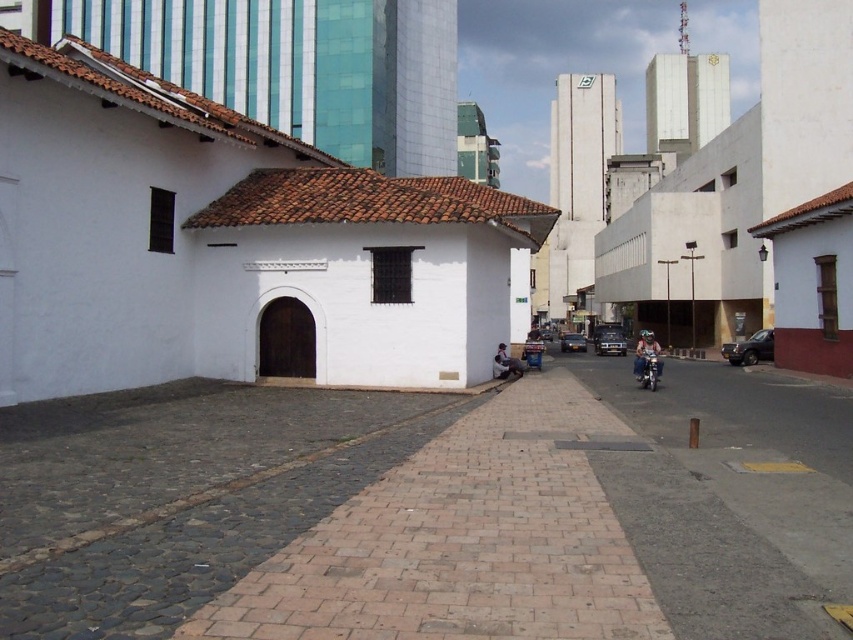
You are a delivery person trying to park your metallic silver sedan at center in a parking spot that can only accommodate vehicles narrower than the dark brown leather jacket at center. Can your car fit in the spot?

The dark brown leather jacket at center is wider than the metallic silver sedan at center, so the sedan can fit in the parking spot since it is narrower than the jacket.

You are standing in the middle of the scene and want to place a small decorative statue between the two points, point (563, 340) and point (550, 339). Which point should the statue be closer to in order to appear closer to the traditional building on the left?

The statue should be placed closer to point (563, 340) because it is closer to the viewer than point (550, 339). Since the traditional building is on the left side of the scene, positioning the statue near the closer point will make it appear nearer to the traditional building from the viewer perspective.

You are a delivery person trying to park your shiny silver sedan at center between the modern high rises and the traditional building. The metallic silver sedan at center is blocking the parking spot. Can you safely maneuver around it to park?

The shiny silver sedan at center is closer to the viewer than the metallic silver sedan at center, so you can safely maneuver around the metallic silver sedan at center to park your vehicle.